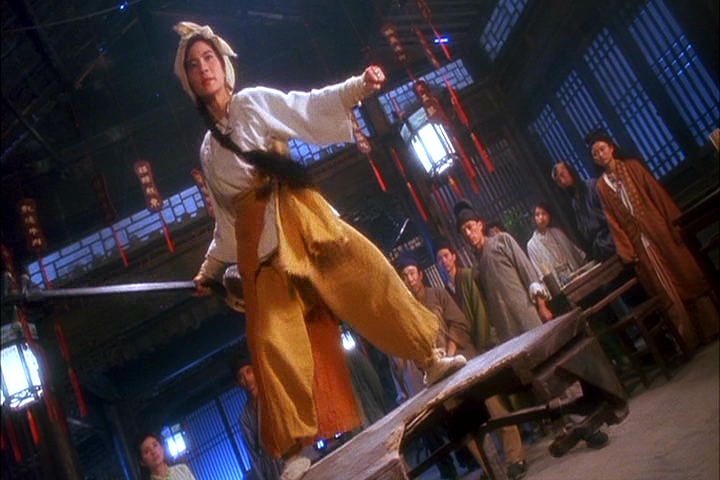
Identify the location of floor. Image resolution: width=720 pixels, height=480 pixels. (652, 439).